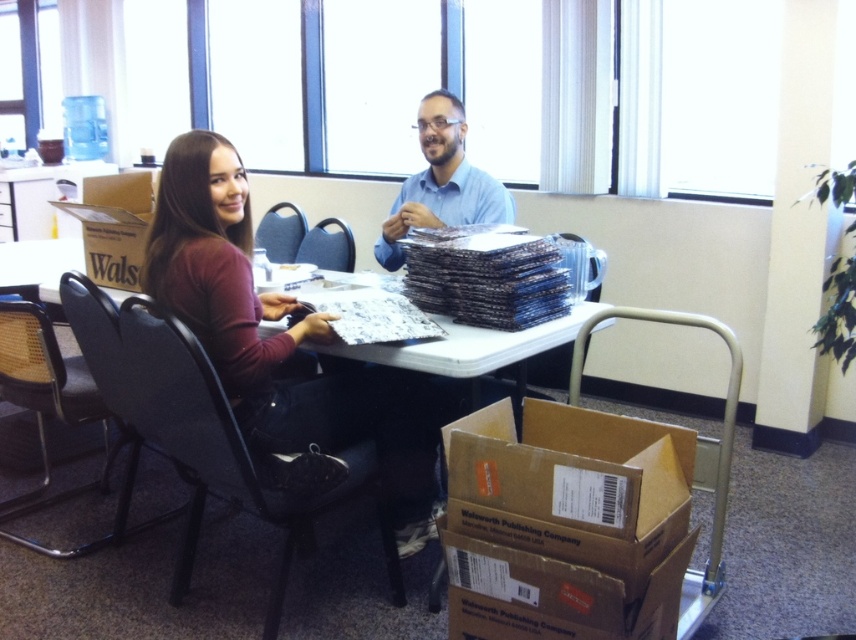
Question: Does brown cardboard box at lower right come in front of matte maroon shirt at center?

Choices:
 (A) no
 (B) yes

Answer: (B)

Question: From the image, what is the correct spatial relationship of blue shirt at center in relation to brown cardboard table at center?

Choices:
 (A) above
 (B) below

Answer: (A)

Question: Does brown cardboard box at lower right appear on the right side of matte maroon shirt at center?

Choices:
 (A) yes
 (B) no

Answer: (A)

Question: Which object is the farthest from the matte maroon shirt at center?

Choices:
 (A) blue shirt at center
 (B) brown cardboard table at center
 (C) brown cardboard box at lower right

Answer: (A)

Question: Which object is closer to the camera taking this photo?

Choices:
 (A) brown cardboard box at lower right
 (B) blue shirt at center
 (C) brown cardboard table at center
 (D) matte maroon shirt at center

Answer: (A)

Question: Which of these objects is positioned farthest from the blue shirt at center?

Choices:
 (A) brown cardboard table at center
 (B) brown cardboard box at lower right
 (C) matte maroon shirt at center

Answer: (B)